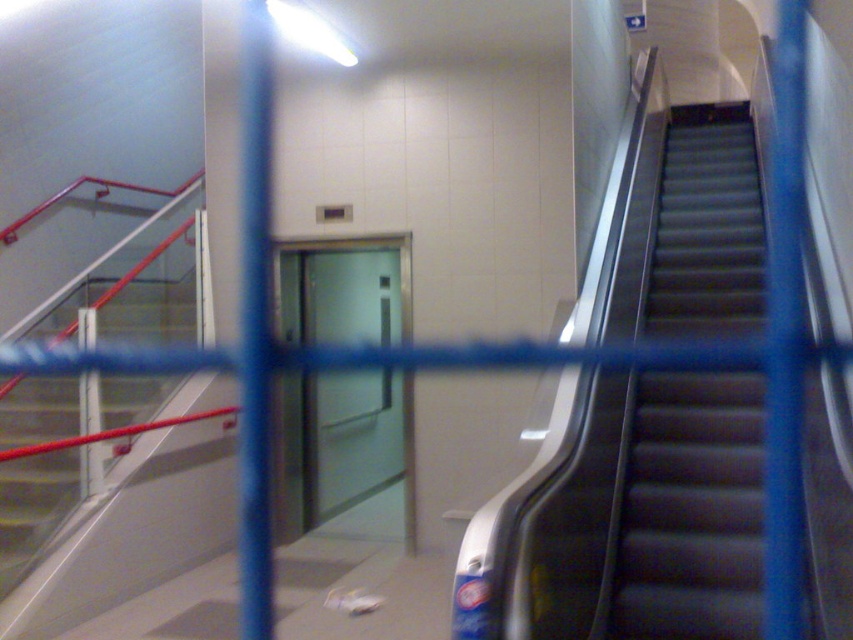
Question: Does metallic gray escalator at right have a greater width compared to transparent glass elevator at center?

Choices:
 (A) yes
 (B) no

Answer: (A)

Question: Which object is the closest to the transparent glass elevator at center?

Choices:
 (A) metallic gray escalator at right
 (B) metallic gray stairs at left

Answer: (B)

Question: Which object appears farthest from the camera in this image?

Choices:
 (A) transparent glass elevator at center
 (B) metallic gray escalator at right
 (C) metallic gray stairs at left

Answer: (A)

Question: Does metallic gray escalator at right have a greater width compared to metallic gray stairs at left?

Choices:
 (A) no
 (B) yes

Answer: (B)

Question: Which point appears farthest from the camera in this image?

Choices:
 (A) [x=363, y=394]
 (B) [x=67, y=470]

Answer: (A)

Question: Does transparent glass elevator at center appear under metallic gray stairs at left?

Choices:
 (A) no
 (B) yes

Answer: (B)